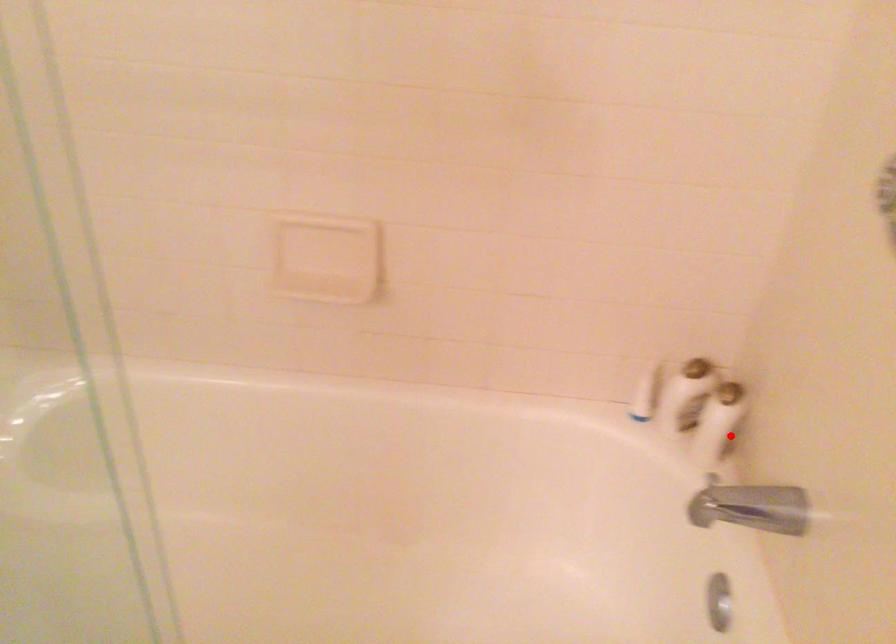
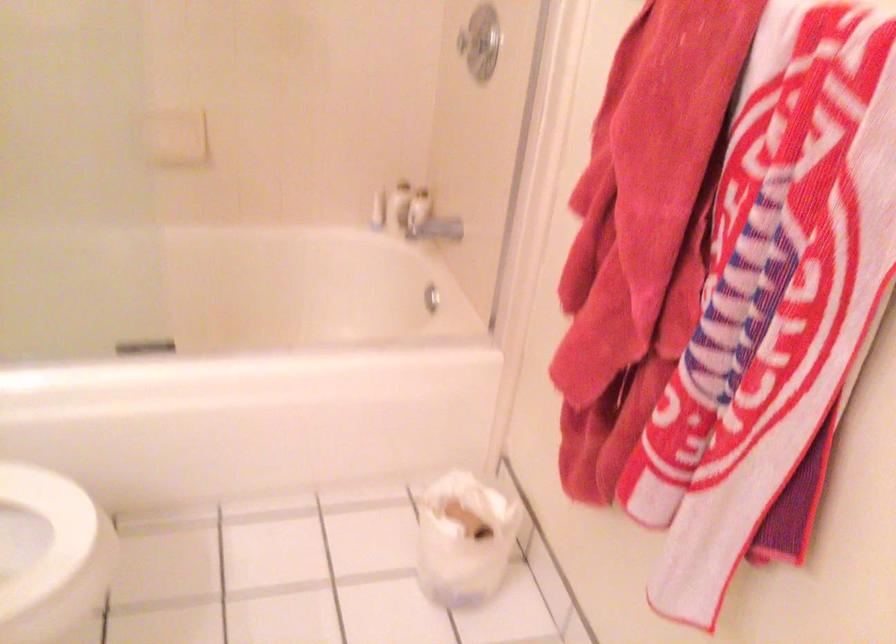
Question: I am providing you with two images of the same scene from different viewpoints. Image1 has a red point marked. In image2, the corresponding 3D location appears at what relative position? Reply with the corresponding letter.

Choices:
 (A) Closer
 (B) Farther

Answer: (B)